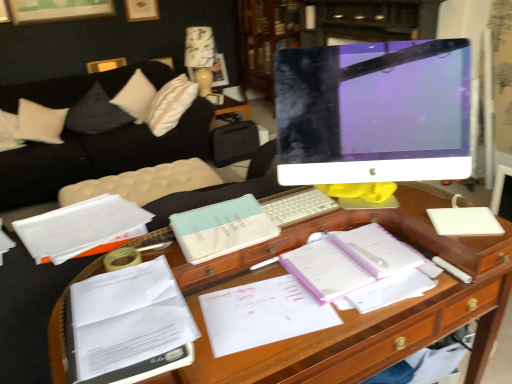
The width and height of the screenshot is (512, 384). I want to click on vacant region above purple spiral notebook at center (from a real-world perspective), so click(350, 245).